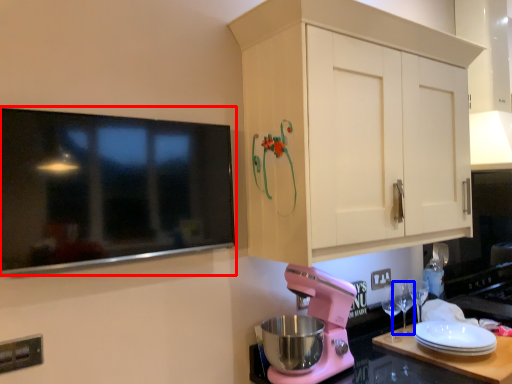
Question: Which point is further to the camera, television (highlighted by a red box) or wine glass (highlighted by a blue box)?

Choices:
 (A) television
 (B) wine glass

Answer: (B)